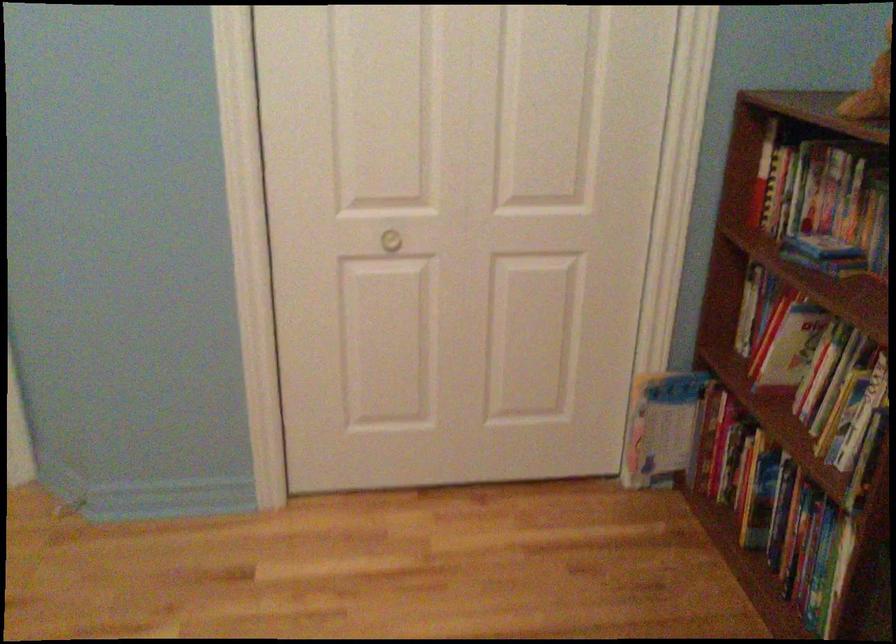
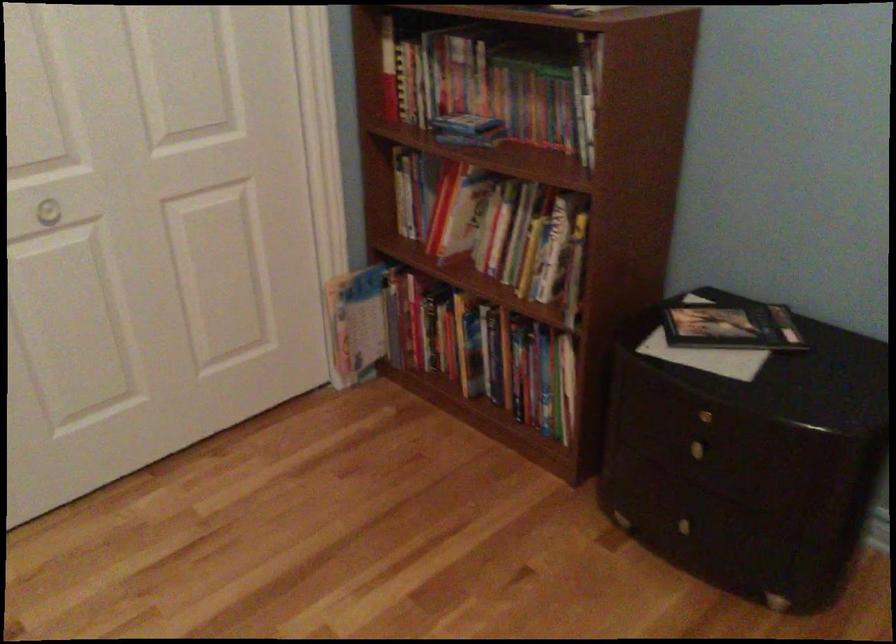
In the second image, find the point that corresponds to pixel 633 427 in the first image.

(338, 332)